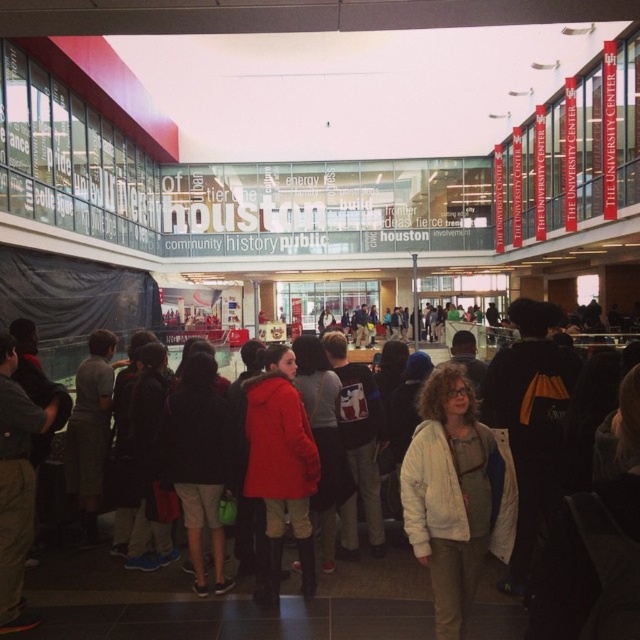
You are standing in the described indoor space and want to reach the point at coordinates point (490, 552). If you can walk straight ahead, will you be able to reach it without obstacles?

The point (490, 552) is 19.28 feet away from the viewer. Since there are no obstacles mentioned in the scene description, you can walk straight ahead to reach it.

You are organizing a charity event and need to display two red garments, the matte red coat at center and the red jacket at center. Which garment is placed higher up?

The matte red coat at center is positioned over the red jacket at center, so the matte red coat at center is placed higher up.

You are standing in the middle of the room and see the point marked as point (454, 493). What object is located at that point?

The white cotton jacket at center is located at point (454, 493).